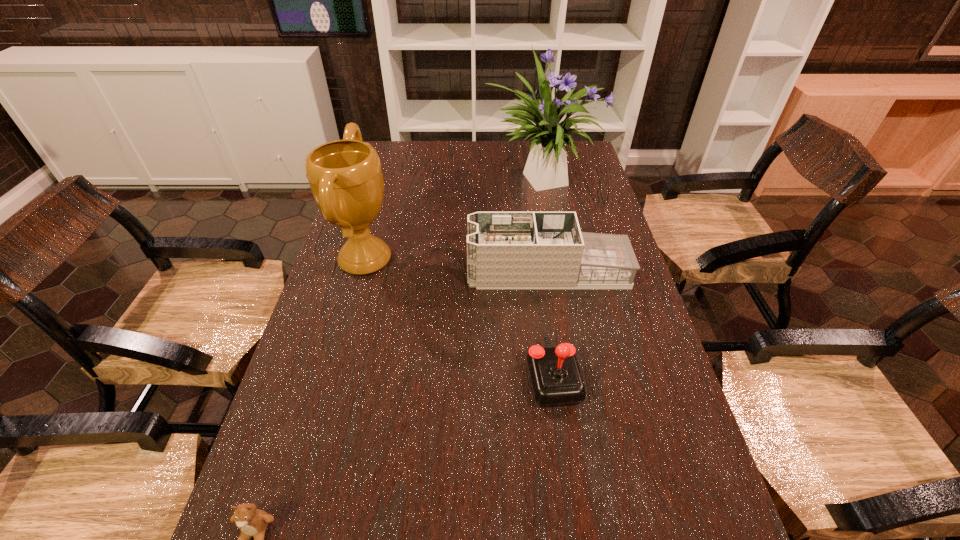
The image size is (960, 540). What are the coordinates of `the farthest object` in the screenshot? It's located at (546, 167).

You are a GUI agent. You are given a task and a screenshot of the screen. Output one action in this format:
    pyautogui.click(x=<x>, y=<y>)
    Task: Click on the tallest object
    
    Given the screenshot: What is the action you would take?
    pyautogui.click(x=546, y=167)

Locate an element on the screen. the fourth shortest object is located at coordinates (345, 176).

Identify the location of dollhouse. This screenshot has height=540, width=960. (505, 250).

This screenshot has width=960, height=540. Identify the location of the fourth farthest object. (556, 380).

You are a GUI agent. You are given a task and a screenshot of the screen. Output one action in this format:
    pyautogui.click(x=<x>, y=<y>)
    Task: Click on the blank area located 0.290m on the front of the flower arrangement
    
    Given the screenshot: What is the action you would take?
    pyautogui.click(x=555, y=265)

The height and width of the screenshot is (540, 960). Find the location of `blank space located 0.090m on the front of the fourth shortest object with the decoration`. blank space located 0.090m on the front of the fourth shortest object with the decoration is located at coordinates [x=426, y=260].

Locate an element on the screen. This screenshot has height=540, width=960. vacant position located at the entrance of the dollhouse is located at coordinates (394, 272).

At what (x,y) coordinates should I click in order to perform the action: click on vacant space situated 0.300m at the entrance of the dollhouse. Please return your answer as a coordinate pair (x, y). Looking at the image, I should click on (367, 272).

Image resolution: width=960 pixels, height=540 pixels. Find the location of `vacant space located 0.390m at the entrance of the dollhouse`. vacant space located 0.390m at the entrance of the dollhouse is located at coordinates (337, 272).